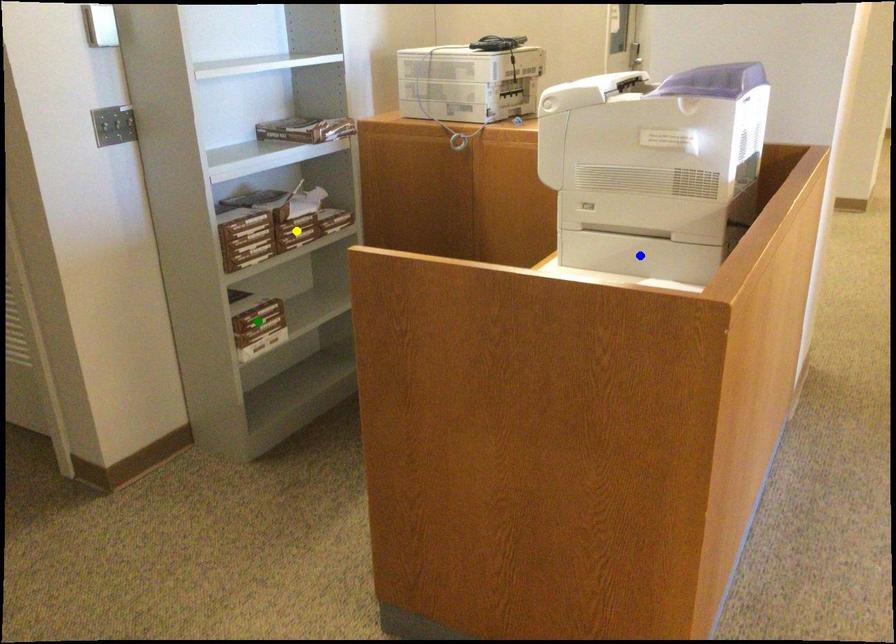
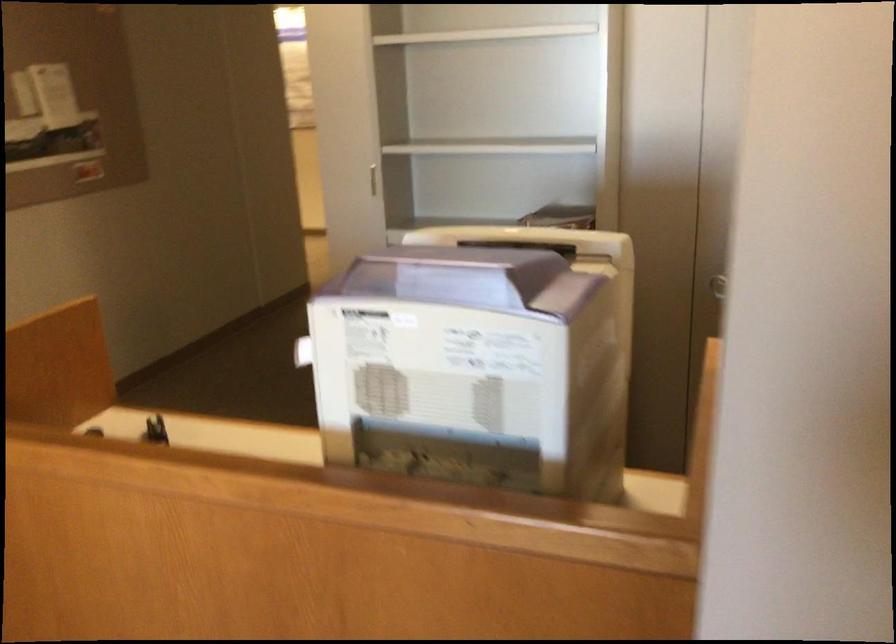
I am providing you with two images of the same scene from different viewpoints. Three points are marked in image1. Which point corresponds to a part or object that is occluded in image2?In image1, three points are marked. Which of them correspond to a part or object that is occluded in image2?Among the three points shown in image1, which one corresponds to a part or object that is no longer visible due to occlusion in image2?

Invisible in image2: yellow point, green point, blue point.